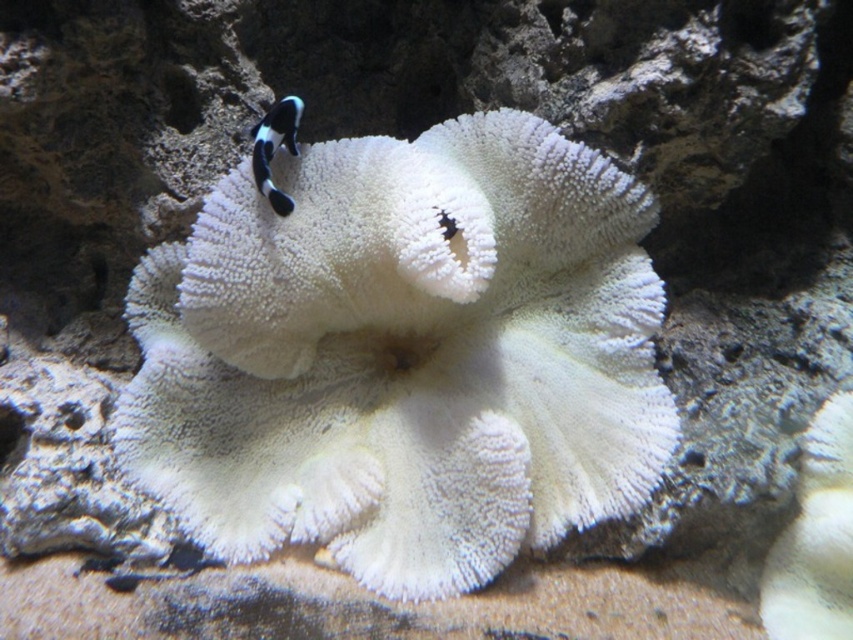
Does white coral at center have a larger size compared to black and white striped fish at center?

Yes.

Which of these two, white coral at center or black and white striped fish at center, stands shorter?

black and white striped fish at center is shorter.

The height and width of the screenshot is (640, 853). In order to click on white coral at center in this screenshot , I will do click(404, 355).

Locate an element on the screen. The width and height of the screenshot is (853, 640). white coral at center is located at coordinates (404, 355).